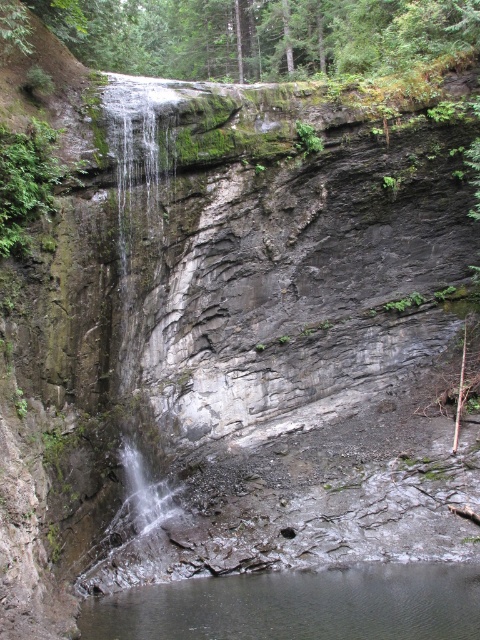
Can you confirm if clear water at lower center is taller than clear water at center?

Incorrect, clear water at lower center's height is not larger of clear water at center's.

Who is higher up, clear water at lower center or clear water at center?

clear water at center

Between point (266, 579) and point (127, 100), which one is positioned behind?

The point (127, 100) is more distant.

In order to click on clear water at lower center in this screenshot , I will do (x=298, y=604).